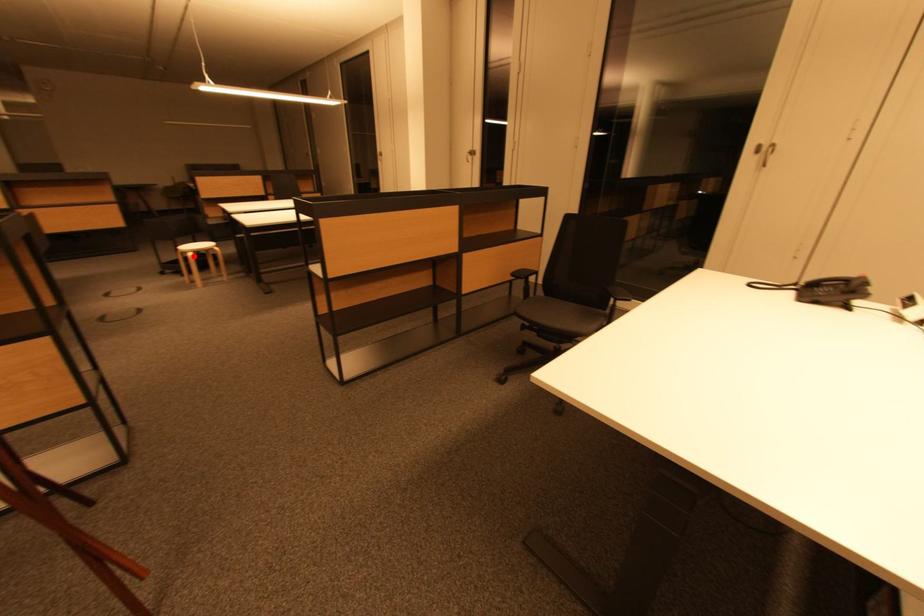
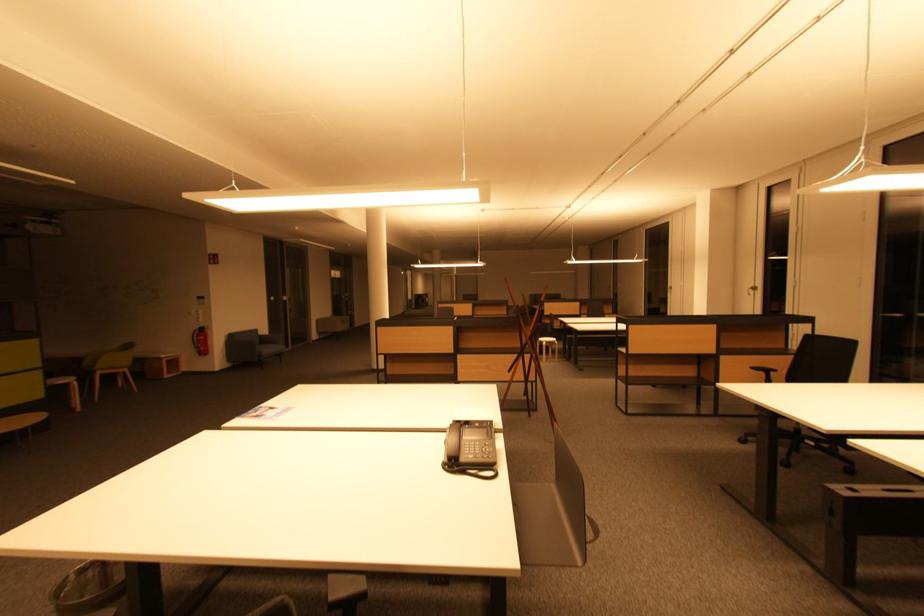
The point at the highlighted location is marked in the first image. Where is the corresponding point in the second image?

(549, 345)